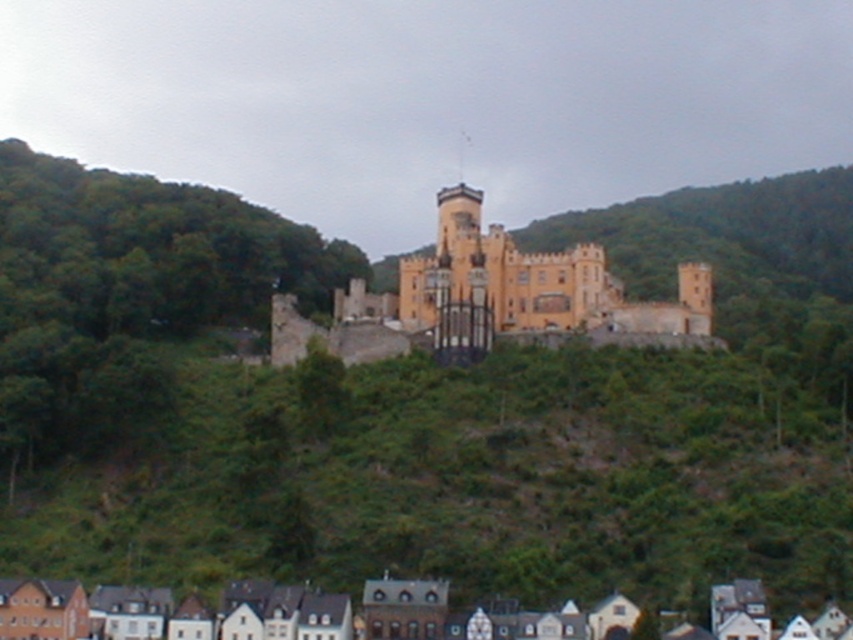
Question: Does matte orange stone castle at center have a smaller size compared to white painted wood houses at lower center?

Choices:
 (A) no
 (B) yes

Answer: (A)

Question: Among these points, which one is nearest to the camera?

Choices:
 (A) (477, 257)
 (B) (622, 625)

Answer: (B)

Question: Is matte orange stone castle at center positioned in front of white painted wood houses at lower center?

Choices:
 (A) yes
 (B) no

Answer: (B)

Question: Where is matte orange stone castle at center located in relation to white painted wood houses at lower center in the image?

Choices:
 (A) above
 (B) below

Answer: (A)

Question: Among these objects, which one is nearest to the camera?

Choices:
 (A) white painted wood houses at lower center
 (B) matte orange stone castle at center

Answer: (A)